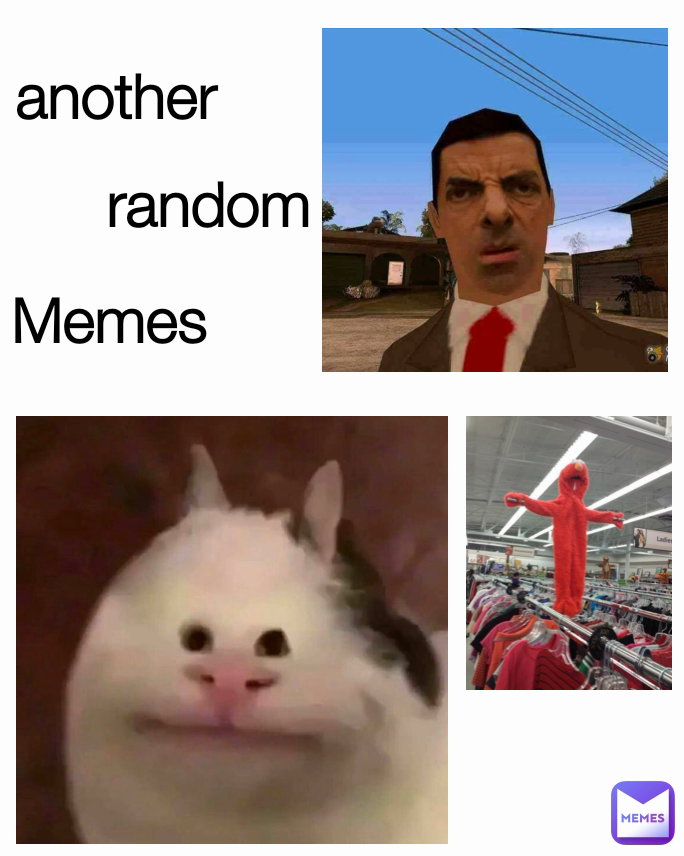
Locate an element on the screen. The width and height of the screenshot is (684, 856). overhead lights is located at coordinates (637, 485), (568, 460), (646, 509).